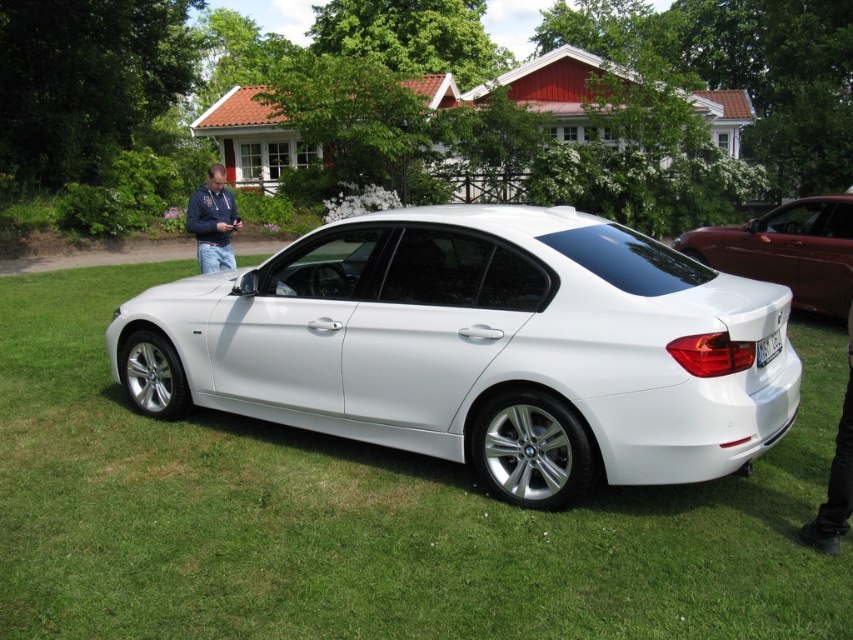
Question: Can you confirm if white metallic car at center is positioned to the left of blue denim jeans at lower left?

Choices:
 (A) yes
 (B) no

Answer: (B)

Question: In this image, where is green grass at center located relative to white plastic license plate at rear?

Choices:
 (A) above
 (B) below

Answer: (B)

Question: Which is farther from the white metallic car at center?

Choices:
 (A) glossy metallic sedan at right
 (B) black leather pants at lower right
 (C) blue denim jeans at lower left

Answer: (A)

Question: Can you confirm if white metallic car at center is positioned to the left of glossy metallic sedan at right?

Choices:
 (A) yes
 (B) no

Answer: (A)

Question: Which of the following is the farthest from the observer?

Choices:
 (A) black leather pants at lower right
 (B) glossy metallic sedan at right
 (C) blue denim jeans at lower left
 (D) white plastic license plate at rear

Answer: (B)

Question: Among these objects, which one is nearest to the camera?

Choices:
 (A) glossy metallic sedan at right
 (B) black leather pants at lower right
 (C) green grass at center
 (D) white metallic car at center

Answer: (C)